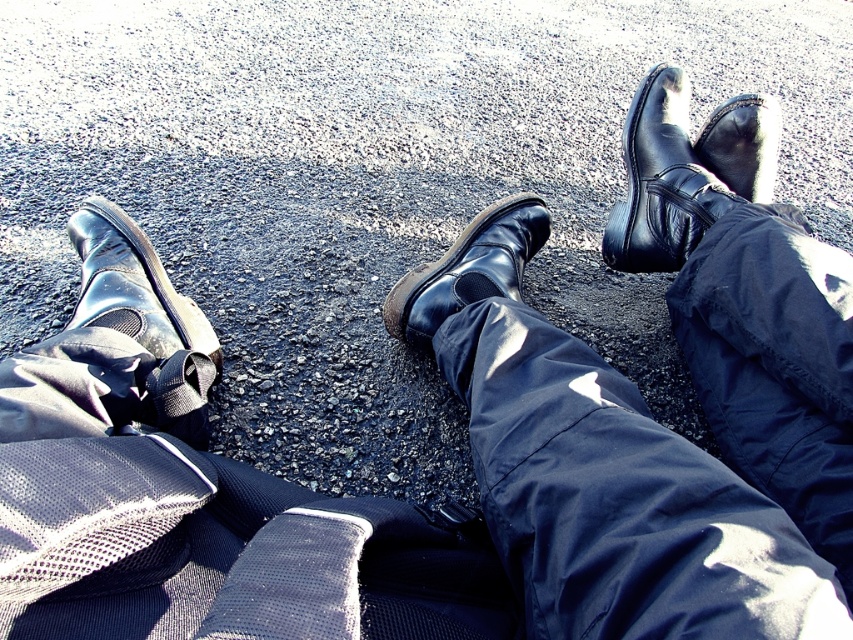
Based on the photo, you are a photographer standing at the camera position. You want to place a 12 inch ruler between the glossy leather boot at lower left and the camera. Is there enough space to fit the ruler without overlapping the boot?

The distance between the glossy leather boot at lower left and the camera is 34.60 inches. Since the ruler is only 12 inches long, there is sufficient space to place it between them without overlapping the boot.